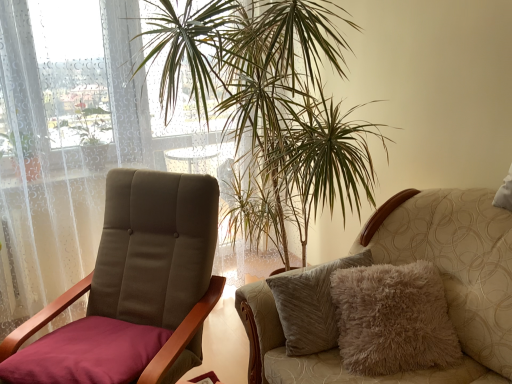
Question: Is point (485, 337) closer or farther from the camera than point (37, 352)?

Choices:
 (A) farther
 (B) closer

Answer: (B)

Question: Is fuzzy beige cushion at right, which appears as the 1th chair when viewed from the right, to the left or to the right of velvet maroon chair at left, which appears as the first chair when viewed from the left, in the image?

Choices:
 (A) left
 (B) right

Answer: (B)

Question: Estimate the real-world distances between objects in this image. Which object is farther from the velvet maroon chair at left, which appears as the first chair when viewed from the left?

Choices:
 (A) fuzzy beige cushion at right, which appears as the 1th chair when viewed from the right
 (B) green leafy plant at center

Answer: (B)

Question: Which is nearer to the green leafy plant at center?

Choices:
 (A) fuzzy beige cushion at right, the second chair from the left
 (B) velvet maroon chair at left, which appears as the first chair when viewed from the left

Answer: (B)